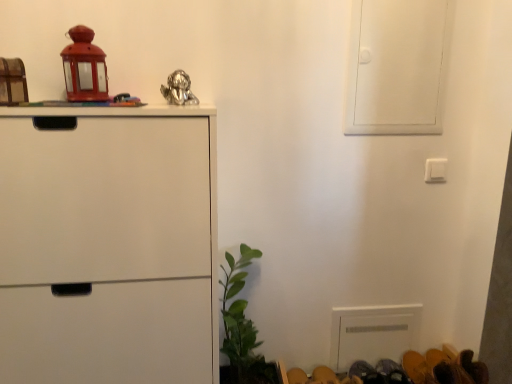
Question: From a real-world perspective, is wooden block at left, the first toy positioned from the left, over green leafy plant at lower center?

Choices:
 (A) yes
 (B) no

Answer: (A)

Question: Is wooden block at left, the third toy positioned from the right, positioned before green leafy plant at lower center?

Choices:
 (A) no
 (B) yes

Answer: (B)

Question: Is wooden block at left, the third toy positioned from the right, at the right side of green leafy plant at lower center?

Choices:
 (A) yes
 (B) no

Answer: (B)

Question: Is wooden block at left, the third toy positioned from the right, to the left of green leafy plant at lower center from the viewer's perspective?

Choices:
 (A) yes
 (B) no

Answer: (A)

Question: Is wooden block at left, the third toy positioned from the right, bigger than green leafy plant at lower center?

Choices:
 (A) yes
 (B) no

Answer: (B)

Question: From a real-world perspective, is wooden block at left, the third toy positioned from the right, located beneath green leafy plant at lower center?

Choices:
 (A) yes
 (B) no

Answer: (B)

Question: Is matte red lantern at upper left, marked as the second toy in a right-to-left arrangement, closer to camera compared to shiny metallic figurine at upper center, which is the 1th toy in right-to-left order?

Choices:
 (A) no
 (B) yes

Answer: (B)

Question: Is matte red lantern at upper left, marked as the second toy in a right-to-left arrangement, next to shiny metallic figurine at upper center, which is the 3th toy from left to right?

Choices:
 (A) yes
 (B) no

Answer: (B)

Question: Is matte red lantern at upper left, which is the 2th toy from left to right, smaller than shiny metallic figurine at upper center, which is the 3th toy from left to right?

Choices:
 (A) yes
 (B) no

Answer: (B)

Question: Is matte red lantern at upper left, marked as the second toy in a right-to-left arrangement, located outside shiny metallic figurine at upper center, which is the 1th toy in right-to-left order?

Choices:
 (A) yes
 (B) no

Answer: (A)

Question: Does matte red lantern at upper left, marked as the second toy in a right-to-left arrangement, turn towards shiny metallic figurine at upper center, which is the 3th toy from left to right?

Choices:
 (A) no
 (B) yes

Answer: (A)

Question: Can you confirm if matte red lantern at upper left, marked as the second toy in a right-to-left arrangement, is taller than shiny metallic figurine at upper center, which is the 1th toy in right-to-left order?

Choices:
 (A) yes
 (B) no

Answer: (A)

Question: Is white matte cabinet at left at the right side of shiny metallic figurine at upper center, which is the 1th toy in right-to-left order?

Choices:
 (A) yes
 (B) no

Answer: (B)